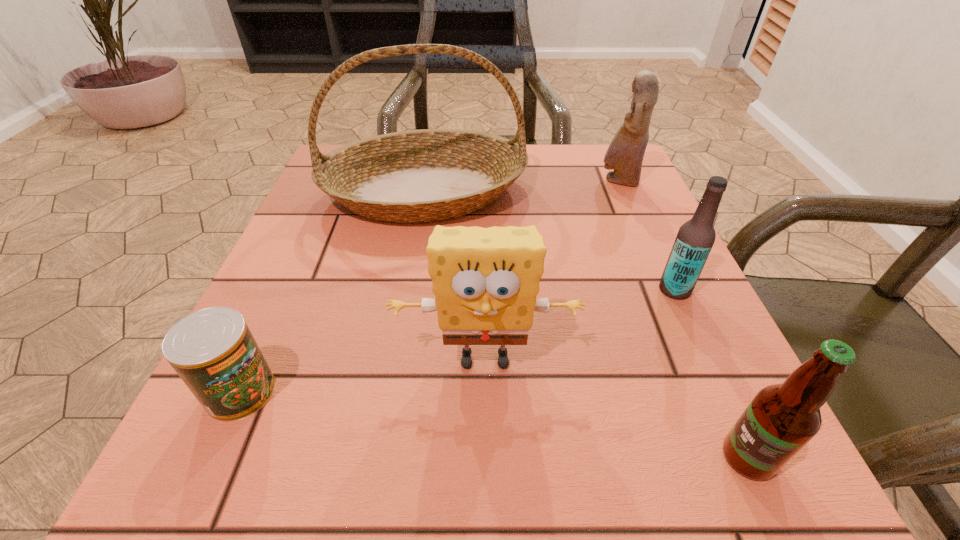
Locate an element on the screen. This screenshot has height=540, width=960. object that is at the near edge is located at coordinates (782, 418).

The height and width of the screenshot is (540, 960). I want to click on basket that is at the left edge, so [x=425, y=175].

Locate an element on the screen. The image size is (960, 540). can that is at the left edge is located at coordinates (213, 351).

Identify the location of figurine that is at the right edge. The image size is (960, 540). (625, 154).

You are a GUI agent. You are given a task and a screenshot of the screen. Output one action in this format:
    pyautogui.click(x=<x>, y=<y>)
    Task: Click on the object that is positioned at the far left corner
    This screenshot has width=960, height=540.
    Given the screenshot: What is the action you would take?
    pyautogui.click(x=425, y=175)

You are a GUI agent. You are given a task and a screenshot of the screen. Output one action in this format:
    pyautogui.click(x=<x>, y=<y>)
    Task: Click on the object located in the far right corner section of the desktop
    
    Given the screenshot: What is the action you would take?
    (625, 154)

You are a GUI agent. You are given a task and a screenshot of the screen. Output one action in this format:
    pyautogui.click(x=<x>, y=<y>)
    Task: Click on the object located in the near right corner section of the desktop
    The width and height of the screenshot is (960, 540).
    Given the screenshot: What is the action you would take?
    pyautogui.click(x=782, y=418)

Locate an element on the screen. The width and height of the screenshot is (960, 540). free spot at the far edge of the desktop is located at coordinates (555, 153).

What are the coordinates of `vacant region at the near edge` in the screenshot? It's located at (630, 440).

Locate an element on the screen. This screenshot has height=540, width=960. vacant space at the left edge of the desktop is located at coordinates (310, 253).